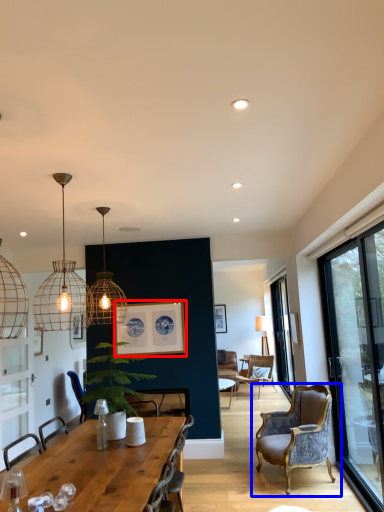
Question: Among these objects, which one is nearest to the camera, picture frame (highlighted by a red box) or chair (highlighted by a blue box)?

Choices:
 (A) picture frame
 (B) chair

Answer: (B)